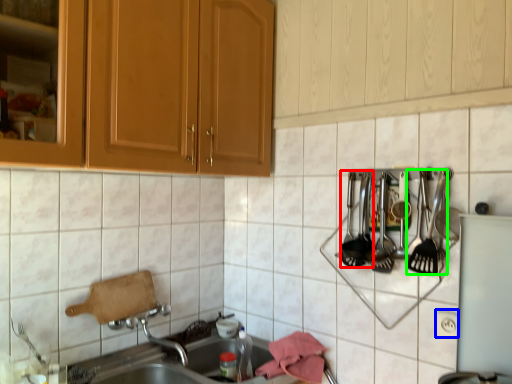
Question: Which object is the closest to the silverware (highlighted by a red box)? Choose among these: electric outlet (highlighted by a blue box) or silverware (highlighted by a green box).

Choices:
 (A) electric outlet
 (B) silverware

Answer: (B)